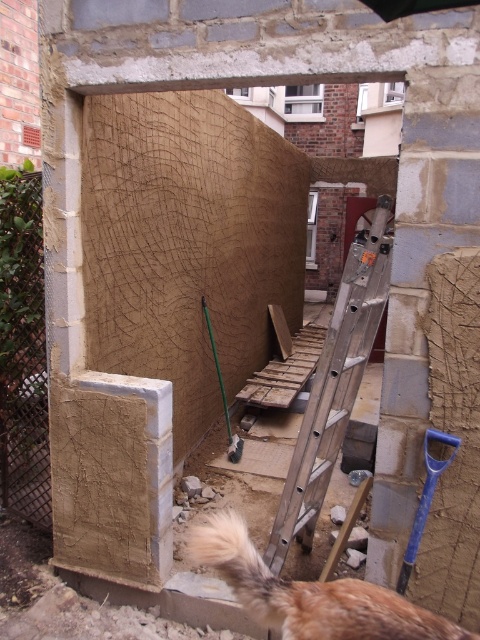
Describe the element at coordinates (241, 568) in the screenshot. I see `brown fluffy tail at lower center` at that location.

Which is below, brown fluffy tail at lower center or blue plastic shovel at lower right?

brown fluffy tail at lower center is lower down.

The height and width of the screenshot is (640, 480). What are the coordinates of `brown fluffy tail at lower center` in the screenshot? It's located at (241, 568).

Who is taller, silver metallic ladder at center or blue plastic shovel at lower right?

silver metallic ladder at center is taller.

Can you confirm if silver metallic ladder at center is positioned to the right of blue plastic shovel at lower right?

No, silver metallic ladder at center is not to the right of blue plastic shovel at lower right.

What do you see at coordinates (335, 385) in the screenshot? This screenshot has height=640, width=480. I see `silver metallic ladder at center` at bounding box center [335, 385].

This screenshot has height=640, width=480. Find the location of `silver metallic ladder at center`. silver metallic ladder at center is located at coordinates (335, 385).

Who is shorter, blue plastic shovel at lower right or green plastic shovel at center?

blue plastic shovel at lower right is shorter.

Who is more distant from viewer, (453,440) or (228,460)?

The point (228,460) is more distant.

Find the location of a particular element. The height and width of the screenshot is (640, 480). blue plastic shovel at lower right is located at coordinates (424, 499).